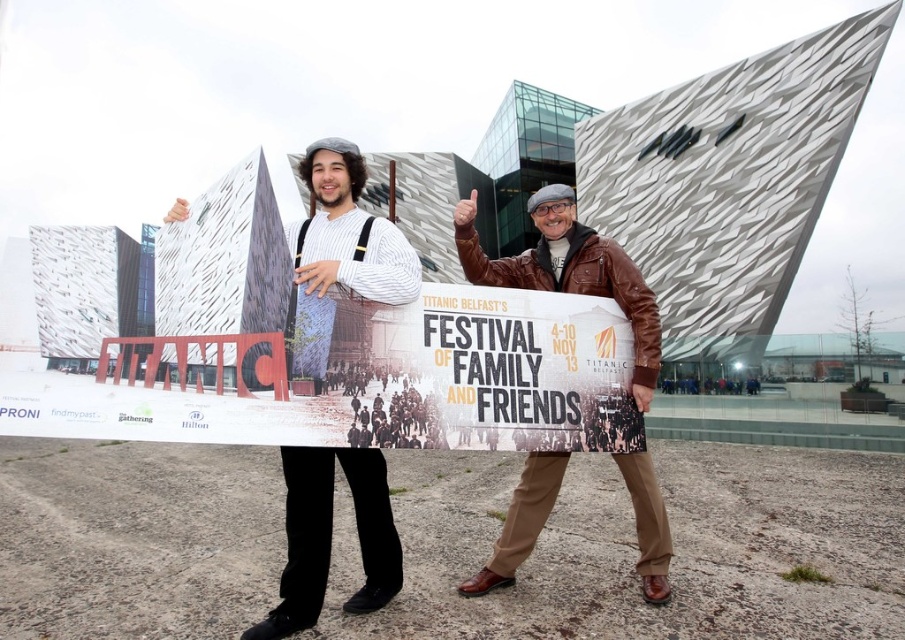
Is striped sweater at center further to camera compared to brown leather jacket at center?

No.

Is striped sweater at center taller than brown leather jacket at center?

Correct, striped sweater at center is much taller as brown leather jacket at center.

Find the location of a particular element. The width and height of the screenshot is (905, 640). striped sweater at center is located at coordinates (331, 536).